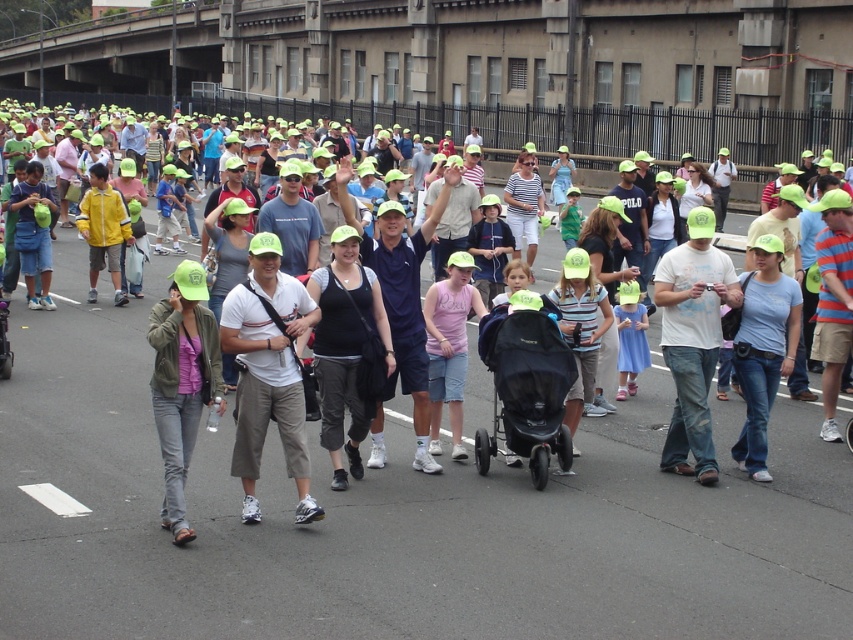
Which is more to the right, white cotton shirt at center or green matte cap at center?

white cotton shirt at center

Consider the image. Who is higher up, white cotton shirt at center or green matte cap at center?

white cotton shirt at center is above.

Between point (276, 321) and point (175, 371), which one is positioned behind?

Point (276, 321)

Locate an element on the screen. Image resolution: width=853 pixels, height=640 pixels. white cotton shirt at center is located at coordinates (268, 371).

Does matte black tank top at center come in front of pink cotton shirt at center?

Yes, matte black tank top at center is in front of pink cotton shirt at center.

Which is behind, point (352, 356) or point (462, 353)?

The point (462, 353) is more distant.

The height and width of the screenshot is (640, 853). I want to click on matte black tank top at center, so click(345, 348).

Does point (744, 285) come closer to viewer compared to point (99, 250)?

Yes, point (744, 285) is closer to viewer.

Can you confirm if blue denim jeans at center is taller than yellow matte jacket at left?

In fact, blue denim jeans at center may be shorter than yellow matte jacket at left.

Between point (782, 298) and point (96, 202), which one is positioned behind?

The point (96, 202) is more distant.

The width and height of the screenshot is (853, 640). Identify the location of blue denim jeans at center. (763, 348).